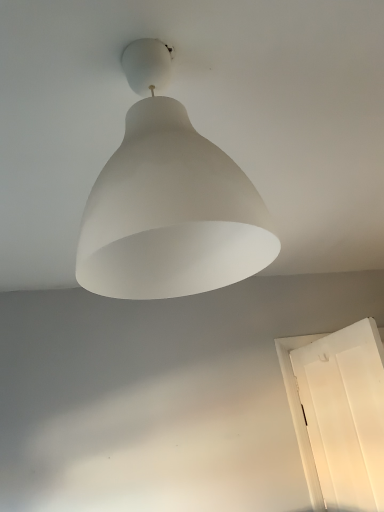
What do you see at coordinates (169, 202) in the screenshot?
I see `white matte lampshade at center` at bounding box center [169, 202].

Find the location of a particular element. The width and height of the screenshot is (384, 512). white matte lampshade at center is located at coordinates (169, 202).

Describe the element at coordinates (300, 412) in the screenshot. This screenshot has height=512, width=384. I see `white matte door at lower right` at that location.

I want to click on white matte door at lower right, so click(300, 412).

The width and height of the screenshot is (384, 512). What are the coordinates of `white matte lampshade at center` in the screenshot? It's located at (169, 202).

Which is more to the left, white matte door at lower right or white matte lampshade at center?

white matte lampshade at center is more to the left.

Is the depth of white matte door at lower right less than that of white matte lampshade at center?

No, white matte door at lower right is further to the viewer.

Is point (298, 426) closer to viewer compared to point (113, 178)?

No, (298, 426) is behind (113, 178).

From the image's perspective, between white matte door at lower right and white matte lampshade at center, who is located below?

white matte door at lower right, from the image's perspective.

From a real-world perspective, who is located lower, white matte door at lower right or white matte lampshade at center?

In real-world perspective, white matte door at lower right is lower.

In terms of width, does white matte door at lower right look wider or thinner when compared to white matte lampshade at center?

white matte door at lower right is thinner than white matte lampshade at center.

Considering the relative sizes of white matte door at lower right and white matte lampshade at center in the image provided, is white matte door at lower right shorter than white matte lampshade at center?

Incorrect, the height of white matte door at lower right does not fall short of that of white matte lampshade at center.

Does white matte door at lower right have a larger size compared to white matte lampshade at center?

Correct, white matte door at lower right is larger in size than white matte lampshade at center.

Is white matte door at lower right outside of white matte lampshade at center?

Absolutely, white matte door at lower right is external to white matte lampshade at center.

Is white matte door at lower right far from white matte lampshade at center?

That's right, there is a large distance between white matte door at lower right and white matte lampshade at center.

Could you tell me if white matte door at lower right is turned towards white matte lampshade at center?

No.

How far apart are white matte door at lower right and white matte lampshade at center?

white matte door at lower right and white matte lampshade at center are 1.89 meters apart.

Locate an element on the screen. Image resolution: width=384 pixels, height=512 pixels. window below the white matte lampshade at center (from the image's perspective) is located at coordinates (300, 412).

Which object is positioned more to the right, white matte lampshade at center or white matte door at lower right?

white matte door at lower right is more to the right.

Is white matte lampshade at center in front of white matte door at lower right?

Yes, white matte lampshade at center is in front of white matte door at lower right.

Is point (166, 226) positioned after point (286, 346)?

No, (166, 226) is in front of (286, 346).

From the image's perspective, is white matte lampshade at center located above or below white matte door at lower right?

white matte lampshade at center is above white matte door at lower right.

From a real-world perspective, who is located lower, white matte lampshade at center or white matte door at lower right?

From a 3D spatial view, white matte door at lower right is below.

Does white matte lampshade at center have a greater width compared to white matte door at lower right?

Yes, white matte lampshade at center is wider than white matte door at lower right.

Can you confirm if white matte lampshade at center is taller than white matte door at lower right?

Incorrect, the height of white matte lampshade at center is not larger of that of white matte door at lower right.

Who is smaller, white matte lampshade at center or white matte door at lower right?

white matte lampshade at center.

Would you say white matte lampshade at center is outside white matte door at lower right?

Yes, white matte lampshade at center is outside of white matte door at lower right.

Is white matte lampshade at center far from white matte door at lower right?

white matte lampshade at center is positioned a significant distance from white matte door at lower right.

Is white matte lampshade at center facing away from white matte door at lower right?

No, white matte lampshade at center's orientation is not away from white matte door at lower right.

I want to click on lamp to the left of white matte door at lower right, so click(x=169, y=202).

Locate an element on the screen. Image resolution: width=384 pixels, height=512 pixels. lamp above the white matte door at lower right (from a real-world perspective) is located at coordinates (169, 202).

Identify the location of lamp in front of the white matte door at lower right. The width and height of the screenshot is (384, 512). (169, 202).